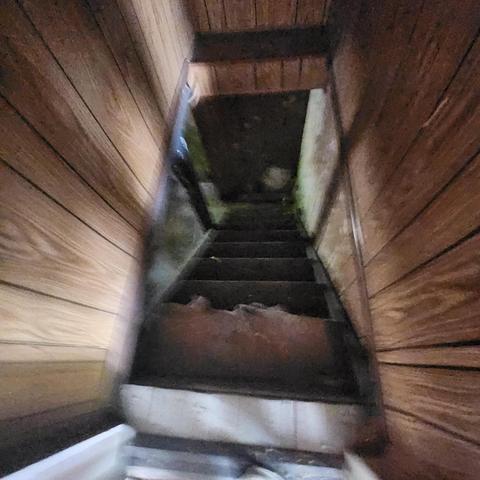
Where is `right sided wood wall`? The height and width of the screenshot is (480, 480). right sided wood wall is located at coordinates (427, 168).